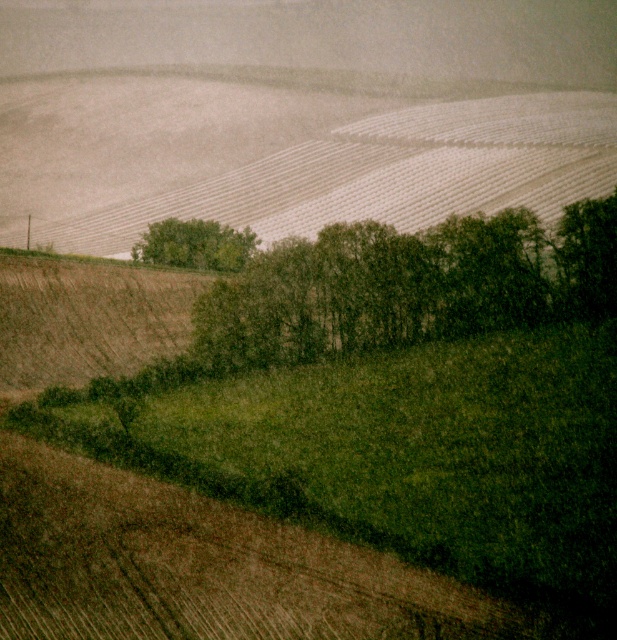
Does green leafy trees at center appear on the right side of green leafy tree at center?

Indeed, green leafy trees at center is positioned on the right side of green leafy tree at center.

Who is positioned more to the left, green leafy trees at center or green leafy tree at center?

From the viewer's perspective, green leafy tree at center appears more on the left side.

This screenshot has width=617, height=640. What do you see at coordinates (407, 285) in the screenshot?
I see `green leafy trees at center` at bounding box center [407, 285].

Where is `green leafy trees at center`? This screenshot has width=617, height=640. green leafy trees at center is located at coordinates (407, 285).